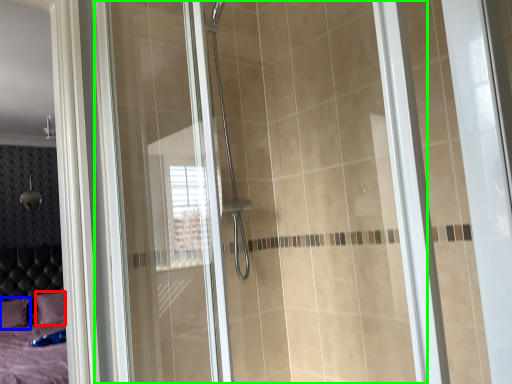
Question: Estimate the real-world distances between objects in this image. Which object is farther from pillow (highlighted by a red box), pillow (highlighted by a blue box) or glass door (highlighted by a green box)?

Choices:
 (A) pillow
 (B) glass door

Answer: (B)